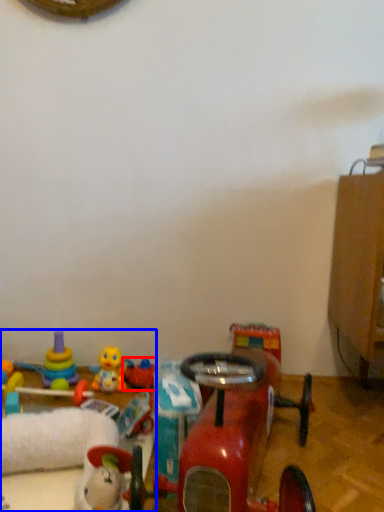
Question: Among these objects, which one is nearest to the camera, toy (highlighted by a red box) or toy (highlighted by a blue box)?

Choices:
 (A) toy
 (B) toy

Answer: (B)